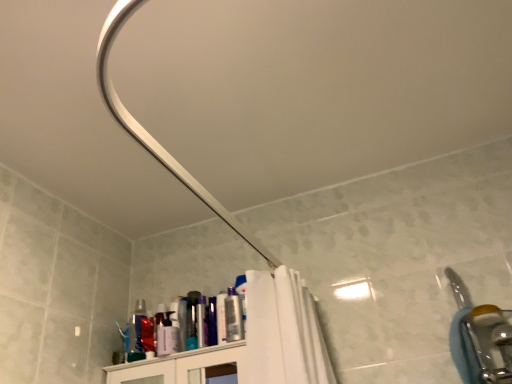
Question: From the image's perspective, is silver metallic faucet at right located above matte plastic can at upper center, positioned as the second toiletry in left-to-right order?

Choices:
 (A) yes
 (B) no

Answer: (B)

Question: Could you tell me if silver metallic faucet at right is facing matte plastic can at upper center, marked as the first toiletry in a right-to-left arrangement?

Choices:
 (A) yes
 (B) no

Answer: (B)

Question: Does silver metallic faucet at right appear on the left side of matte plastic can at upper center, positioned as the second toiletry in left-to-right order?

Choices:
 (A) yes
 (B) no

Answer: (B)

Question: From a real-world perspective, does silver metallic faucet at right sit lower than matte plastic can at upper center, marked as the first toiletry in a right-to-left arrangement?

Choices:
 (A) yes
 (B) no

Answer: (A)

Question: Is silver metallic faucet at right far away from matte plastic can at upper center, marked as the first toiletry in a right-to-left arrangement?

Choices:
 (A) no
 (B) yes

Answer: (A)

Question: Does silver metallic faucet at right lie in front of matte plastic can at upper center, marked as the first toiletry in a right-to-left arrangement?

Choices:
 (A) yes
 (B) no

Answer: (A)

Question: From the image's perspective, is metallic silver can at upper center, the 1th toiletry when ordered from left to right, located above matte plastic can at upper center, marked as the first toiletry in a right-to-left arrangement?

Choices:
 (A) no
 (B) yes

Answer: (A)

Question: Is metallic silver can at upper center, the 2th toiletry in the right-to-left sequence, taller than matte plastic can at upper center, positioned as the second toiletry in left-to-right order?

Choices:
 (A) yes
 (B) no

Answer: (B)

Question: Does metallic silver can at upper center, the 2th toiletry in the right-to-left sequence, have a lesser height compared to matte plastic can at upper center, marked as the first toiletry in a right-to-left arrangement?

Choices:
 (A) yes
 (B) no

Answer: (A)

Question: Could matte plastic can at upper center, marked as the first toiletry in a right-to-left arrangement, be considered to be inside metallic silver can at upper center, the 1th toiletry when ordered from left to right?

Choices:
 (A) no
 (B) yes

Answer: (A)

Question: Is metallic silver can at upper center, the 2th toiletry in the right-to-left sequence, next to matte plastic can at upper center, positioned as the second toiletry in left-to-right order, and touching it?

Choices:
 (A) no
 (B) yes

Answer: (A)

Question: From a real-world perspective, is metallic silver can at upper center, the 1th toiletry when ordered from left to right, located higher than matte plastic can at upper center, marked as the first toiletry in a right-to-left arrangement?

Choices:
 (A) no
 (B) yes

Answer: (B)

Question: Is the depth of silver metallic faucet at right greater than that of metallic silver can at upper center, the 2th toiletry in the right-to-left sequence?

Choices:
 (A) yes
 (B) no

Answer: (B)